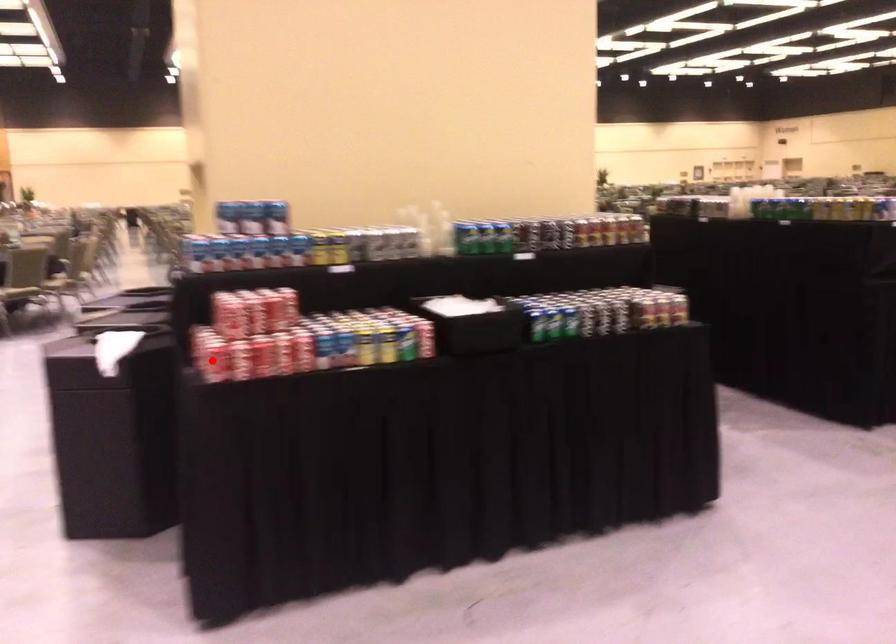
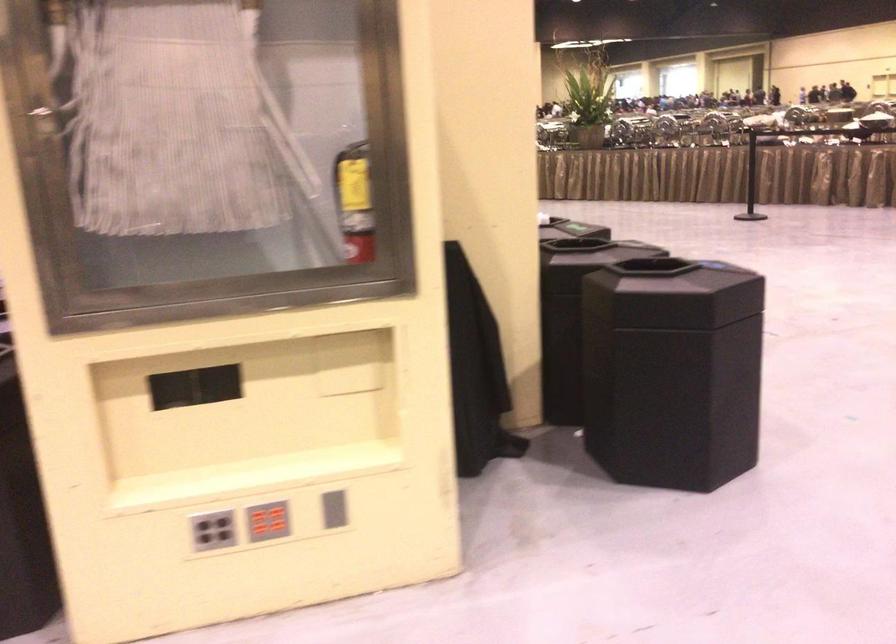
Question: I am providing you with two images of the same scene from different viewpoints. A red point is marked on the first image. Is the red point's position out of view in image 2?

Choices:
 (A) Yes
 (B) No

Answer: (A)